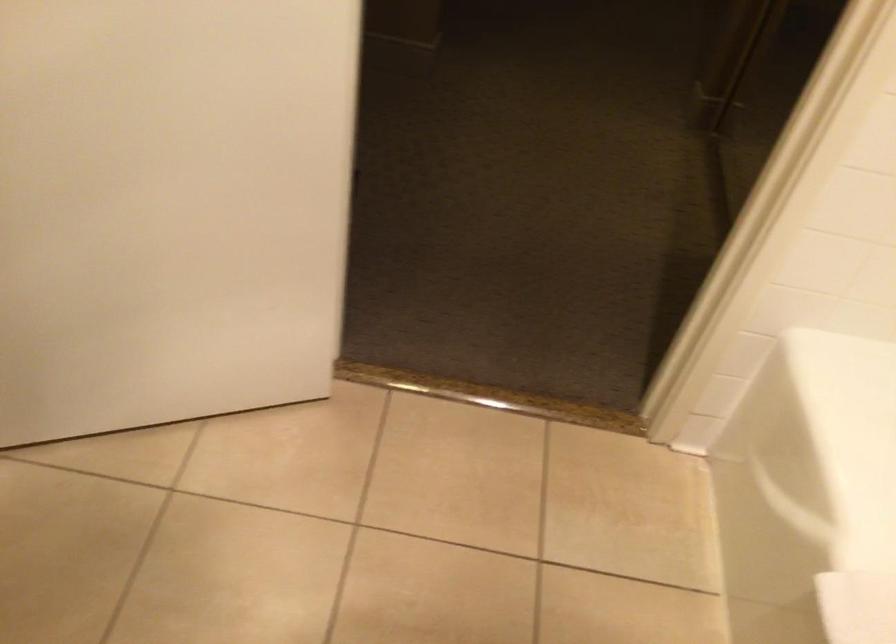
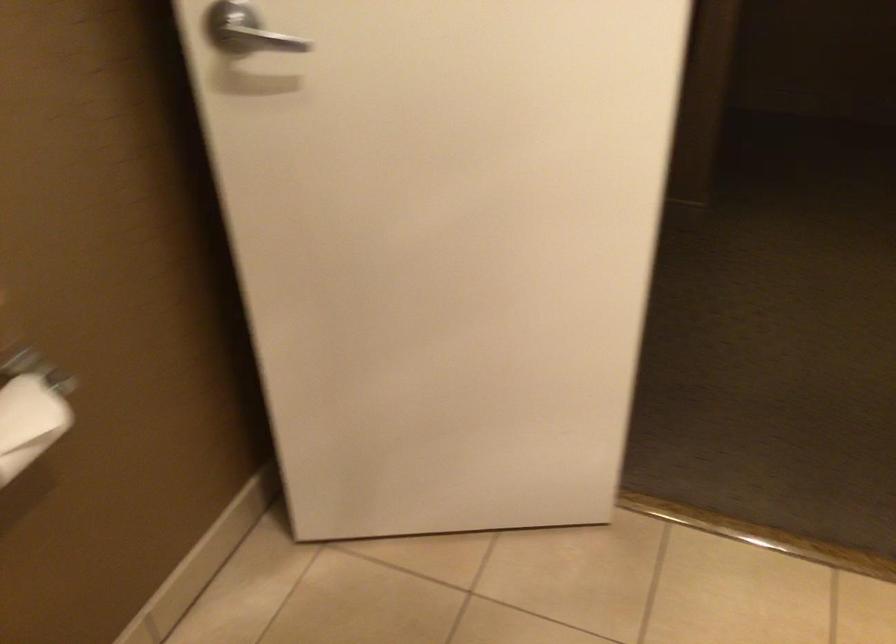
Question: How did the camera likely rotate?

Choices:
 (A) Left
 (B) Right
 (C) Up
 (D) Down

Answer: (A)